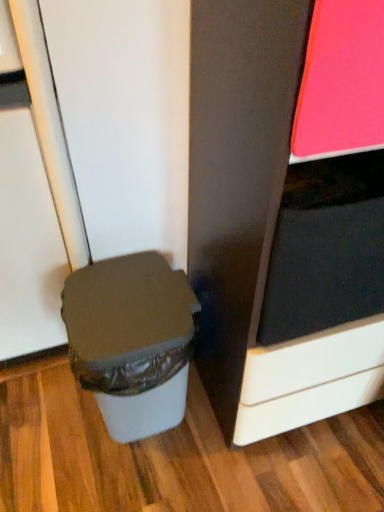
Question: Is the depth of white plastic waste bin at lower left less than that of matte black cabinet at right?

Choices:
 (A) no
 (B) yes

Answer: (A)

Question: Can you confirm if white plastic waste bin at lower left is shorter than matte black cabinet at right?

Choices:
 (A) no
 (B) yes

Answer: (A)

Question: Considering the relative sizes of white plastic waste bin at lower left and matte black cabinet at right in the image provided, is white plastic waste bin at lower left wider than matte black cabinet at right?

Choices:
 (A) no
 (B) yes

Answer: (A)

Question: Is white plastic waste bin at lower left oriented away from matte black cabinet at right?

Choices:
 (A) no
 (B) yes

Answer: (A)

Question: Is white plastic waste bin at lower left next to matte black cabinet at right and touching it?

Choices:
 (A) no
 (B) yes

Answer: (A)

Question: Is white plastic waste bin at lower left at the left side of matte black cabinet at right?

Choices:
 (A) no
 (B) yes

Answer: (B)

Question: From the image's perspective, would you say matte black cabinet at right is positioned over white plastic waste bin at lower left?

Choices:
 (A) yes
 (B) no

Answer: (A)

Question: Is matte black cabinet at right at the right side of white plastic waste bin at lower left?

Choices:
 (A) yes
 (B) no

Answer: (A)

Question: Can you confirm if matte black cabinet at right is bigger than white plastic waste bin at lower left?

Choices:
 (A) yes
 (B) no

Answer: (B)

Question: From a real-world perspective, does matte black cabinet at right stand above white plastic waste bin at lower left?

Choices:
 (A) no
 (B) yes

Answer: (B)

Question: From a real-world perspective, is matte black cabinet at right physically below white plastic waste bin at lower left?

Choices:
 (A) no
 (B) yes

Answer: (A)

Question: Would you consider matte black cabinet at right to be distant from white plastic waste bin at lower left?

Choices:
 (A) no
 (B) yes

Answer: (A)

Question: Relative to matte black cabinet at right, is white plastic waste bin at lower left in front or behind?

Choices:
 (A) front
 (B) behind

Answer: (B)